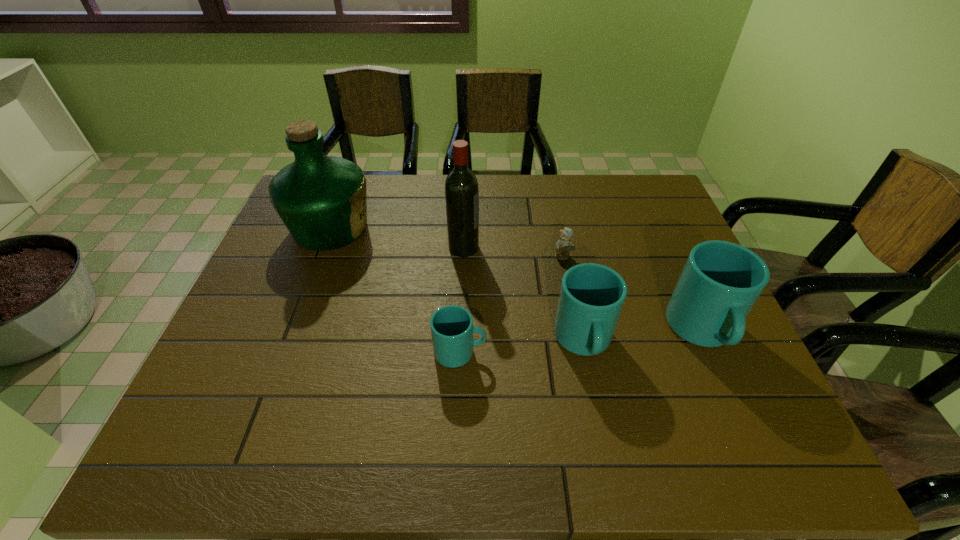
Where is `vacant area situated on the handle side of the rightmost object`? The height and width of the screenshot is (540, 960). vacant area situated on the handle side of the rightmost object is located at coordinates (730, 394).

Find the location of `vacant space located on the label of the wine bottle`. vacant space located on the label of the wine bottle is located at coordinates (521, 247).

This screenshot has width=960, height=540. I want to click on blank area located 0.060m on the label side of the leftmost object, so click(x=395, y=228).

I want to click on blank space located on the front-facing side of the shortest object, so click(x=582, y=350).

What are the coordinates of `object that is at the far edge` in the screenshot? It's located at (322, 200).

The height and width of the screenshot is (540, 960). Identify the location of object at the near edge. (591, 298).

At what (x,y) coordinates should I click in order to perform the action: click on object located in the left edge section of the desktop. Please return your answer as a coordinate pair (x, y). This screenshot has width=960, height=540. Looking at the image, I should click on (322, 200).

Locate an element on the screen. The height and width of the screenshot is (540, 960). object situated at the right edge is located at coordinates (721, 281).

Locate an element on the screen. The image size is (960, 540). object positioned at the far left corner is located at coordinates 322,200.

Locate an element on the screen. The width and height of the screenshot is (960, 540). vacant space at the far edge of the desktop is located at coordinates coord(426,194).